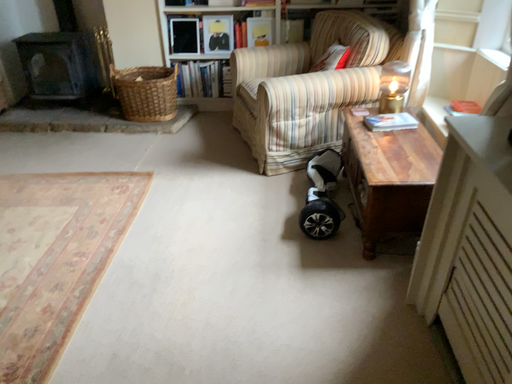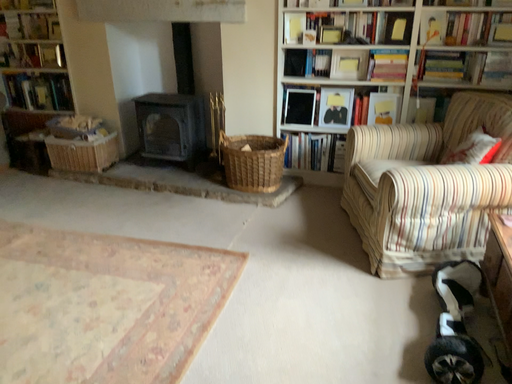
Question: How did the camera likely rotate when shooting the video?

Choices:
 (A) rotated upward
 (B) rotated downward

Answer: (A)